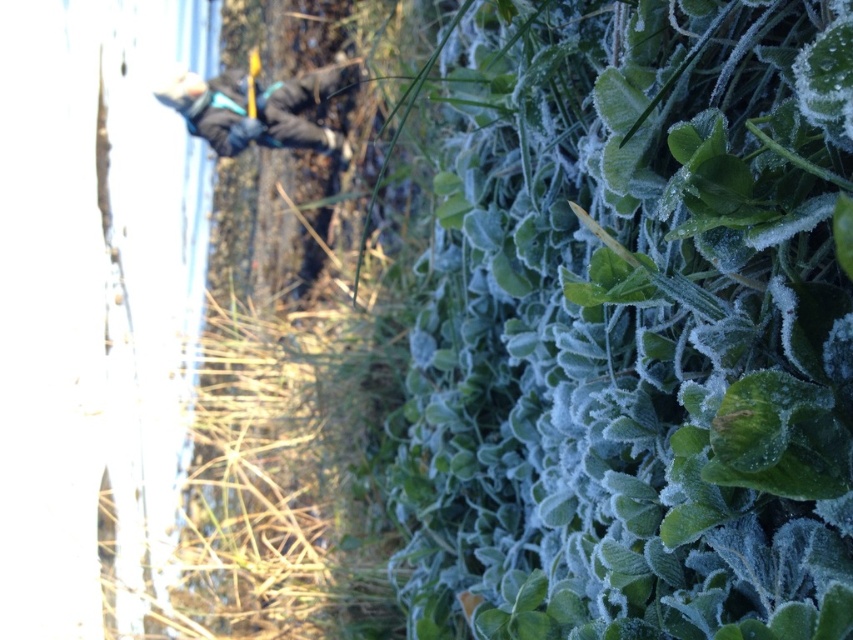
You are standing in the frosty outdoor scene and want to take a photo of both the green frosted leaves at lower right and the dark gray jacket at upper left. Which object should you zoom in on to capture more detail of the frost texture?

You should zoom in on the green frosted leaves at lower right because they are smaller in width compared to the dark gray jacket at upper left, allowing you to focus on their delicate frost texture.

You are a photographer trying to capture the frosty details of the green frosted leaves at lower right and the dark gray jacket at upper left. Which object should you zoom in on to ensure the frost texture is clearly visible?

The green frosted leaves at lower right should be zoomed in on because they are larger in size than the dark gray jacket at upper left, making their frost texture more visible.

You are standing in the frosty outdoor scene and want to pick up the green frosted leaves at lower right. What are the coordinates where you should look to find them?

The green frosted leaves at lower right are located at coordinates point (637, 326).